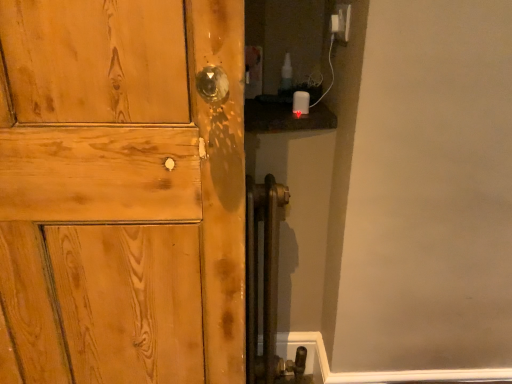
This screenshot has height=384, width=512. I want to click on white plastic electric outlet at upper right, so click(341, 22).

This screenshot has width=512, height=384. What do you see at coordinates (341, 22) in the screenshot?
I see `white plastic electric outlet at upper right` at bounding box center [341, 22].

What is the approximate height of white plastic electric outlet at upper right?

3.83 inches.

Describe the element at coordinates (122, 191) in the screenshot. I see `matte wood door at center` at that location.

I want to click on matte wood door at center, so click(x=122, y=191).

Locate an element on the screen. Image resolution: width=512 pixels, height=384 pixels. white plastic electric outlet at upper right is located at coordinates (341, 22).

Based on their positions, is matte wood door at center located to the left or right of white plastic electric outlet at upper right?

matte wood door at center is positioned on white plastic electric outlet at upper right's left side.

Which is behind, matte wood door at center or white plastic electric outlet at upper right?

white plastic electric outlet at upper right is further from the camera.

Which is behind, point (215, 373) or point (345, 34)?

The point (215, 373) is farther.

From the image's perspective, between matte wood door at center and white plastic electric outlet at upper right, who is located below?

matte wood door at center, from the image's perspective.

From a real-world perspective, which is physically above, matte wood door at center or white plastic electric outlet at upper right?

From a 3D spatial view, white plastic electric outlet at upper right is above.

Considering the sizes of matte wood door at center and white plastic electric outlet at upper right in the image, is matte wood door at center wider or thinner than white plastic electric outlet at upper right?

Clearly, matte wood door at center has more width compared to white plastic electric outlet at upper right.

Considering the relative sizes of matte wood door at center and white plastic electric outlet at upper right in the image provided, is matte wood door at center taller than white plastic electric outlet at upper right?

Yes, matte wood door at center is taller than white plastic electric outlet at upper right.

Does matte wood door at center have a smaller size compared to white plastic electric outlet at upper right?

No.

Would you say matte wood door at center contains white plastic electric outlet at upper right?

No, white plastic electric outlet at upper right is not surrounded by matte wood door at center.

Is matte wood door at center touching white plastic electric outlet at upper right?

matte wood door at center is not next to white plastic electric outlet at upper right, and they're not touching.

Is matte wood door at center aimed at white plastic electric outlet at upper right?

No, matte wood door at center is not aimed at white plastic electric outlet at upper right.

How many degrees apart are the facing directions of matte wood door at center and white plastic electric outlet at upper right?

The angular difference between matte wood door at center and white plastic electric outlet at upper right is 91 degrees.

Where is `electric outlet that is on the right side of matte wood door at center`? Image resolution: width=512 pixels, height=384 pixels. electric outlet that is on the right side of matte wood door at center is located at coordinates (341, 22).

Which is more to the left, white plastic electric outlet at upper right or matte wood door at center?

From the viewer's perspective, matte wood door at center appears more on the left side.

Is white plastic electric outlet at upper right positioned behind matte wood door at center?

Yes, white plastic electric outlet at upper right is further from the camera.

Does point (334, 11) appear closer or farther from the camera than point (195, 164)?

Clearly, point (334, 11) is more distant from the camera than point (195, 164).

From the image's perspective, is white plastic electric outlet at upper right above or below matte wood door at center?

Based on their image positions, white plastic electric outlet at upper right is located above matte wood door at center.

From a real-world perspective, does white plastic electric outlet at upper right sit lower than matte wood door at center?

No, from a real-world perspective, white plastic electric outlet at upper right is not under matte wood door at center.

Between white plastic electric outlet at upper right and matte wood door at center, which one has smaller width?

white plastic electric outlet at upper right.

Who is shorter, white plastic electric outlet at upper right or matte wood door at center?

With less height is white plastic electric outlet at upper right.

Considering the sizes of objects white plastic electric outlet at upper right and matte wood door at center in the image provided, who is bigger, white plastic electric outlet at upper right or matte wood door at center?

With larger size is matte wood door at center.

From the picture: Can we say white plastic electric outlet at upper right lies outside matte wood door at center?

Yes, white plastic electric outlet at upper right is outside of matte wood door at center.

Would you consider white plastic electric outlet at upper right to be distant from matte wood door at center?

white plastic electric outlet at upper right is near matte wood door at center, not far away.

Is white plastic electric outlet at upper right facing towards matte wood door at center?

No, white plastic electric outlet at upper right is not aimed at matte wood door at center.

In the scene shown: How different are the orientations of white plastic electric outlet at upper right and matte wood door at center in degrees?

There is a 91-degree angle between the facing directions of white plastic electric outlet at upper right and matte wood door at center.

Locate an element on the screen. The width and height of the screenshot is (512, 384). door beneath the white plastic electric outlet at upper right (from a real-world perspective) is located at coordinates (122, 191).

This screenshot has height=384, width=512. I want to click on electric outlet on the right of matte wood door at center, so click(x=341, y=22).

This screenshot has width=512, height=384. I want to click on door on the left of white plastic electric outlet at upper right, so click(x=122, y=191).